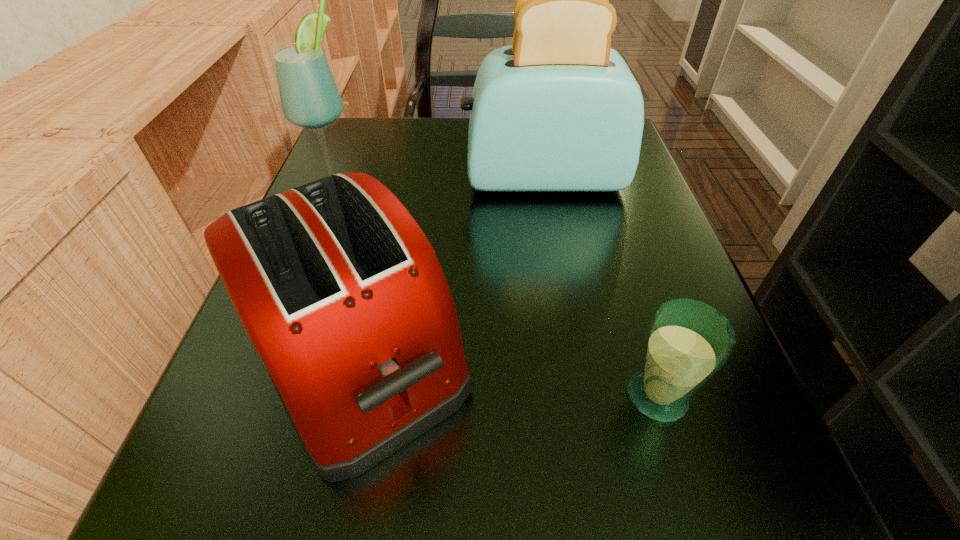
Locate an element on the screen. The image size is (960, 540). vacant area that satisfies the following two spatial constraints: 1. on the side of the taller toaster with the lever; 2. on the front side of the second shortest object is located at coordinates (573, 355).

Locate an element on the screen. vacant point that satisfies the following two spatial constraints: 1. on the front side of the shorter toaster; 2. on the right side of the shortest object is located at coordinates (347, 396).

Locate an element on the screen. The width and height of the screenshot is (960, 540). vacant space that satisfies the following two spatial constraints: 1. on the side of the taller toaster with the lever; 2. on the back side of the glass is located at coordinates (580, 396).